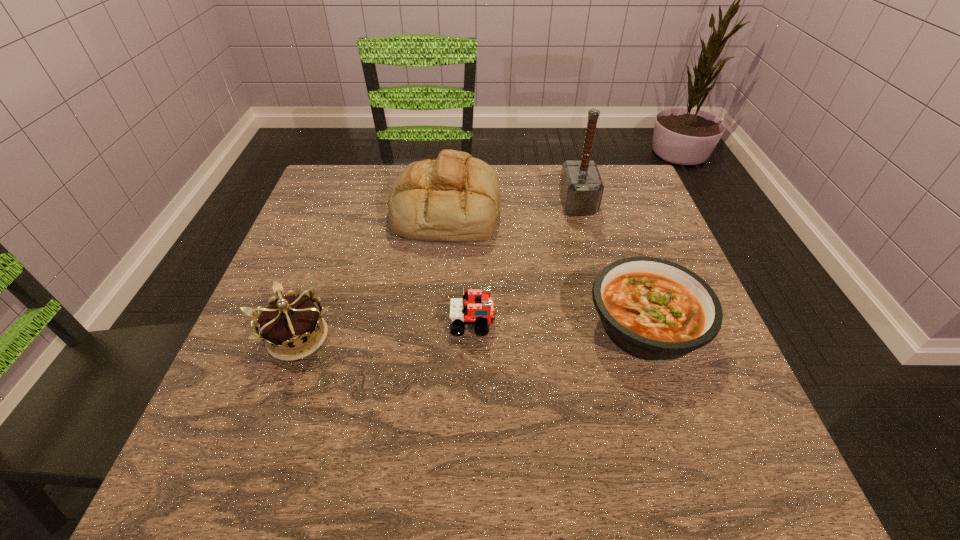
You are a GUI agent. You are given a task and a screenshot of the screen. Output one action in this format:
    pyautogui.click(x=<x>, y=<y>)
    Task: Click on the hammer
    The height and width of the screenshot is (540, 960).
    Given the screenshot: What is the action you would take?
    pos(581,187)

Find the location of a particular element. bread is located at coordinates (456, 197).

The image size is (960, 540). In order to click on crown in this screenshot , I will do `click(289, 326)`.

Identify the location of the leftmost object. (289, 326).

Where is `Lego`? The height and width of the screenshot is (540, 960). Lego is located at coordinates (461, 312).

The image size is (960, 540). In order to click on stew in this screenshot , I will do `click(656, 310)`.

Image resolution: width=960 pixels, height=540 pixels. I want to click on vacant point located on the back of the tallest object, so click(x=569, y=170).

Find the location of a particular element. This screenshot has height=540, width=960. vacant region located on the right of the fourth shortest object is located at coordinates (543, 210).

Identify the location of vacant region located 0.090m on the right of the crown. This screenshot has height=540, width=960. (386, 337).

You are a GUI agent. You are given a task and a screenshot of the screen. Output one action in this format:
    pyautogui.click(x=<x>, y=<y>)
    Task: Click on the free space located on the front-facing side of the Lego
    The image size is (960, 540).
    Given the screenshot: What is the action you would take?
    pyautogui.click(x=531, y=323)